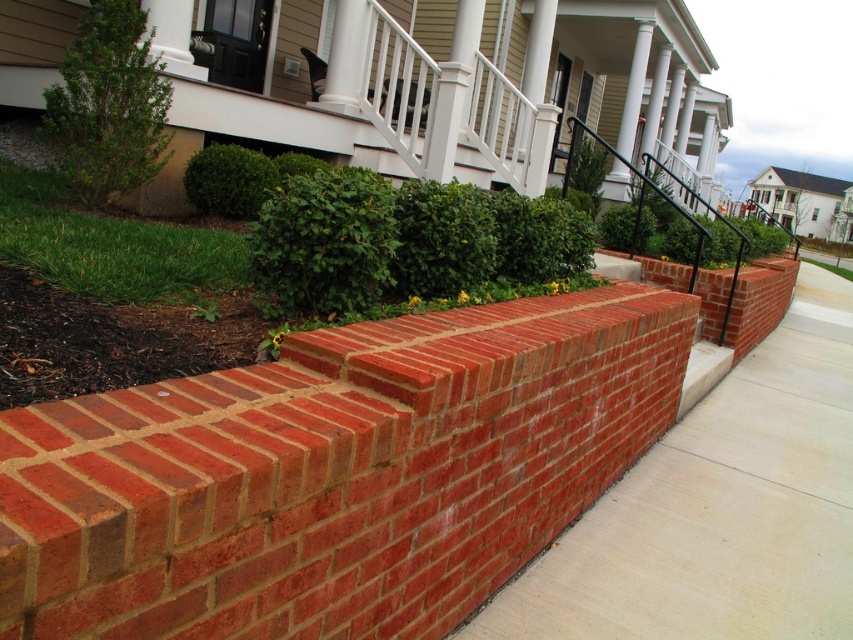
Question: Estimate the real-world distances between objects in this image. Which object is farther from the green leafy bush at upper left?

Choices:
 (A) red brick wall at center
 (B) green leafy hedge at center

Answer: (A)

Question: From the image, what is the correct spatial relationship of red brick pavement at center in relation to green leafy bush at upper left?

Choices:
 (A) above
 (B) below

Answer: (B)

Question: Is red brick pavement at center bigger than green leafy hedge at center?

Choices:
 (A) yes
 (B) no

Answer: (A)

Question: Which object is closer to the camera taking this photo?

Choices:
 (A) green leafy bush at upper left
 (B) red brick wall at center
 (C) green leafy hedge at center
 (D) red brick pavement at center

Answer: (B)

Question: Which object is closer to the camera taking this photo?

Choices:
 (A) red brick wall at center
 (B) red brick pavement at center
 (C) green leafy bush at upper left
 (D) green leafy hedge at center

Answer: (A)

Question: Is red brick wall at center positioned before green leafy hedge at center?

Choices:
 (A) no
 (B) yes

Answer: (B)